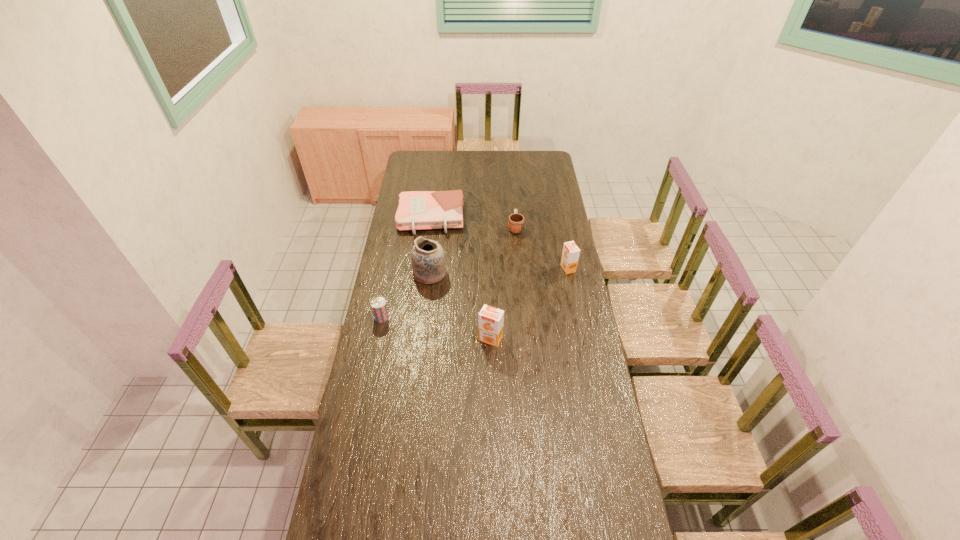
This screenshot has height=540, width=960. What are the coordinates of `free point located 0.240m on the side of the mug with the handle` in the screenshot? It's located at (513, 193).

At what (x,y) coordinates should I click in order to perform the action: click on free space located on the side of the mug with the handle. Please return your answer as a coordinate pair (x, y). Image resolution: width=960 pixels, height=540 pixels. Looking at the image, I should click on (512, 189).

What are the coordinates of `free space located on the side of the mug with the handle` in the screenshot? It's located at (512, 187).

Locate an element on the screen. This screenshot has height=540, width=960. free location located 0.260m on the right of the pottery is located at coordinates (501, 274).

This screenshot has width=960, height=540. Identify the location of vacant space located on the front of the phonebook. (425, 262).

The width and height of the screenshot is (960, 540). What are the coordinates of `free space located 0.390m on the back of the beer can` in the screenshot? It's located at (395, 252).

Locate an element on the screen. The image size is (960, 540). pottery present at the left edge is located at coordinates (428, 260).

Identify the location of phonebook located in the left edge section of the desktop. The width and height of the screenshot is (960, 540). (418, 210).

You are a GUI agent. You are given a task and a screenshot of the screen. Output one action in this format:
    pyautogui.click(x=<x>, y=<y>)
    Task: Click on the beer can located in the left edge section of the desktop
    
    Given the screenshot: What is the action you would take?
    pyautogui.click(x=378, y=304)

Where is `object located at the right edge`? The width and height of the screenshot is (960, 540). object located at the right edge is located at coordinates (570, 255).